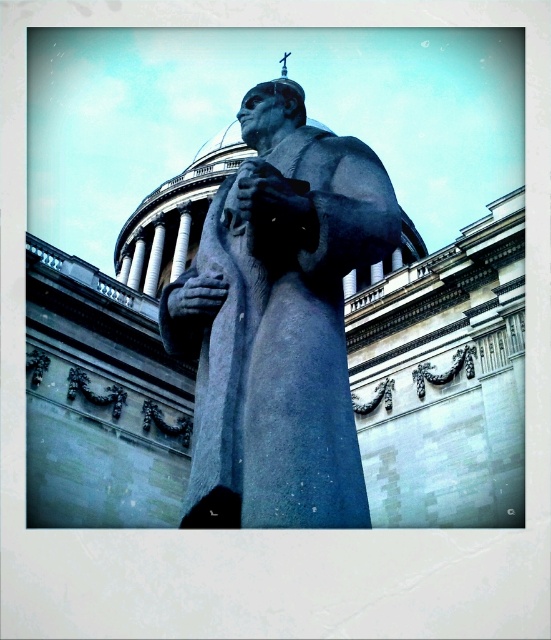
You are an art student analyzing the statue and its components. You notice the gray stone statue at center and the matte gray stone hand at center. Which object is located to the right?

The matte gray stone hand at center is located to the right of the gray stone statue at center.